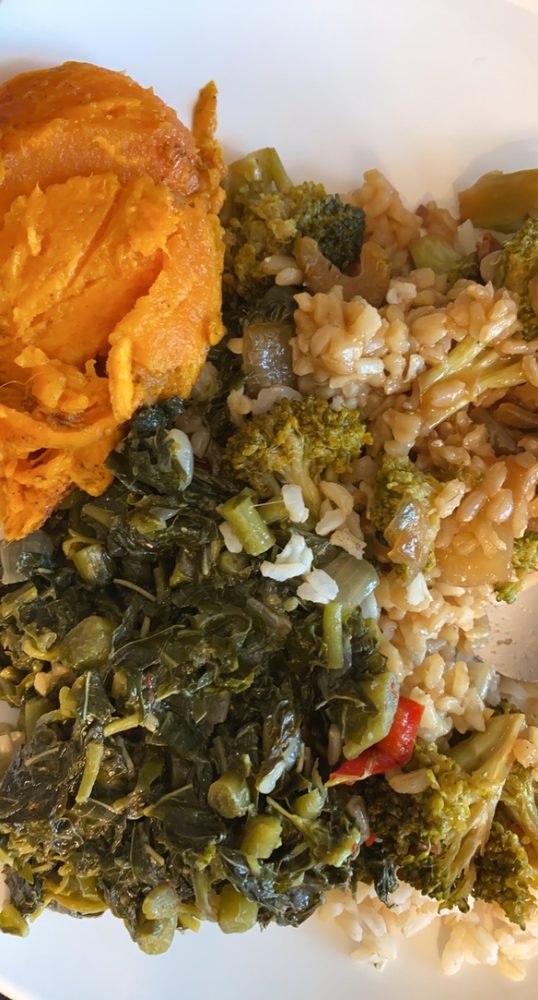
In order to click on plate in this screenshot , I will do `click(94, 955)`.